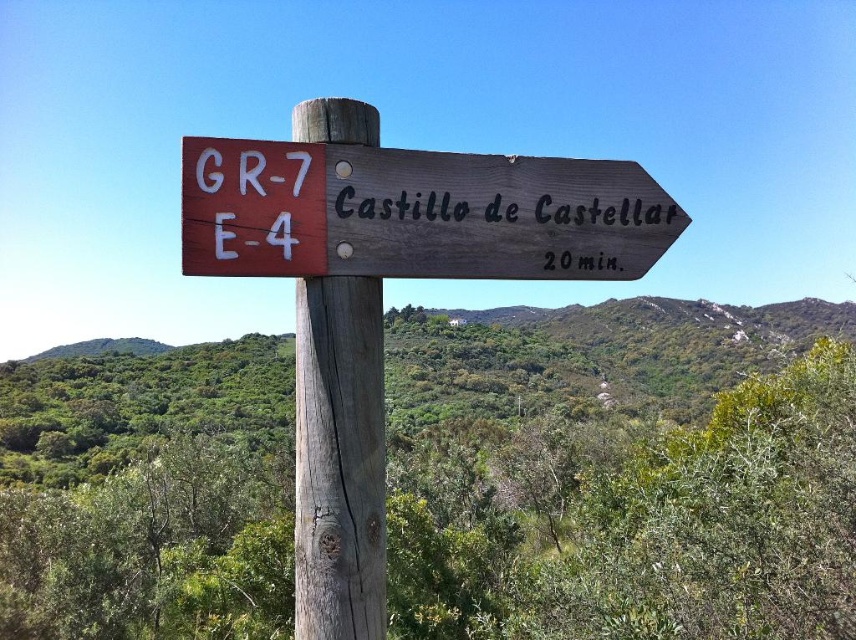
You are a GUI agent. You are given a task and a screenshot of the screen. Output one action in this format:
    pyautogui.click(x=<x>, y=<y>)
    Task: Click on the wooden signpost at center
    This screenshot has width=856, height=640.
    Given the screenshot: What is the action you would take?
    pyautogui.click(x=415, y=212)

Who is more forward, (569, 180) or (366, 552)?

Point (366, 552) is more forward.

The height and width of the screenshot is (640, 856). What do you see at coordinates (415, 212) in the screenshot?
I see `wooden signpost at center` at bounding box center [415, 212].

At what (x,y) coordinates should I click in order to perform the action: click on wooden signpost at center. Please return your answer as a coordinate pair (x, y). This screenshot has height=640, width=856. Looking at the image, I should click on pyautogui.click(x=415, y=212).

Does wooden signpost at center have a smaller size compared to brown wooden sign at upper right?

Actually, wooden signpost at center might be larger than brown wooden sign at upper right.

Image resolution: width=856 pixels, height=640 pixels. Describe the element at coordinates (415, 212) in the screenshot. I see `wooden signpost at center` at that location.

Where is `wooden signpost at center`? The image size is (856, 640). wooden signpost at center is located at coordinates (415, 212).

Is wooden post at center taller than brown wooden sign at upper right?

Correct, wooden post at center is much taller as brown wooden sign at upper right.

Does wooden post at center appear on the left side of brown wooden sign at upper right?

Correct, you'll find wooden post at center to the left of brown wooden sign at upper right.

Image resolution: width=856 pixels, height=640 pixels. What do you see at coordinates (339, 460) in the screenshot? I see `wooden post at center` at bounding box center [339, 460].

Locate an element on the screen. wooden post at center is located at coordinates (339, 460).